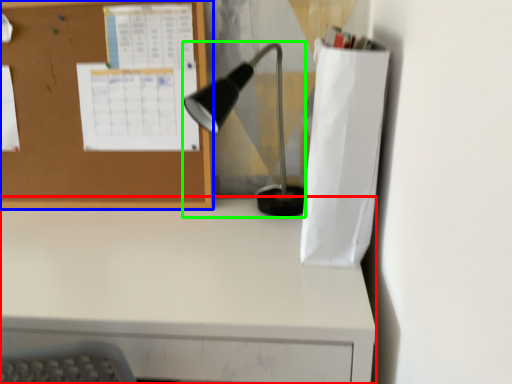
Question: Based on their relative distances, which object is nearer to desk (highlighted by a red box)? Choose from bulletin board (highlighted by a blue box) and lamp (highlighted by a green box).

Choices:
 (A) bulletin board
 (B) lamp

Answer: (A)